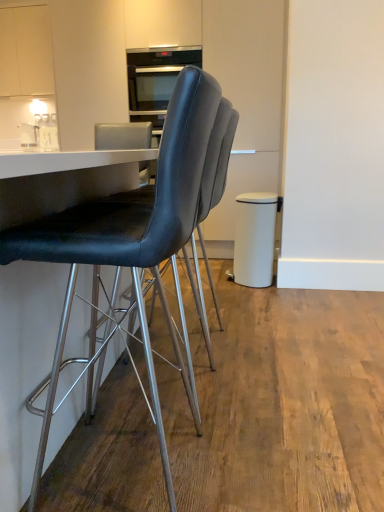
The width and height of the screenshot is (384, 512). Find the location of `free space in front of white matte trash can at right`. free space in front of white matte trash can at right is located at coordinates (265, 294).